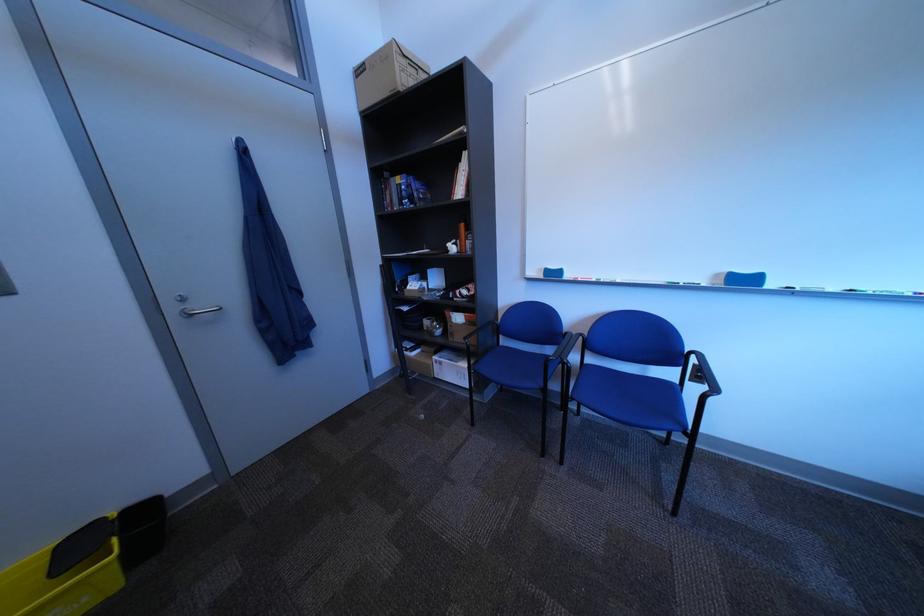
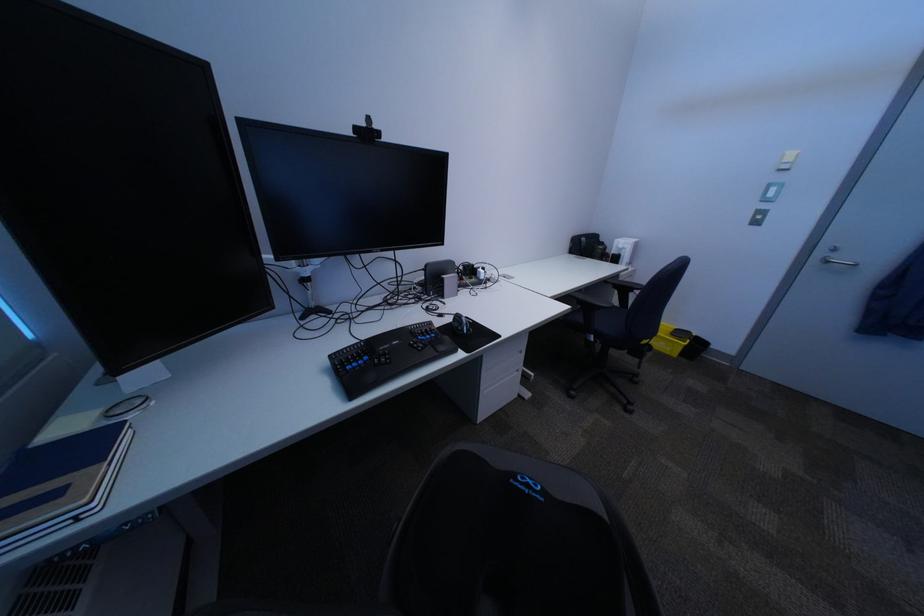
Locate, in the second image, the point that corresponds to (x=187, y=310) in the first image.

(834, 254)